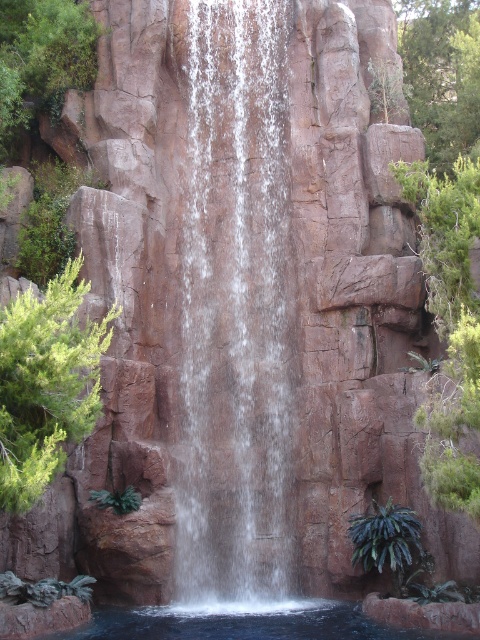
Question: Does smooth brown rock at center appear on the left side of green leafy tree at upper right?

Choices:
 (A) no
 (B) yes

Answer: (B)

Question: Based on their relative distances, which object is farther from the clear water at bottom?

Choices:
 (A) green leafy plant at lower right
 (B) green leafy plant at upper left
 (C) green leafy tree at left
 (D) smooth brown rock at center

Answer: (B)

Question: Is green leafy tree at left positioned behind clear water at bottom?

Choices:
 (A) yes
 (B) no

Answer: (B)

Question: Observing the image, what is the correct spatial positioning of smooth brown rock at center in reference to green leafy plant at lower right?

Choices:
 (A) above
 (B) below

Answer: (A)

Question: Which object is positioned farthest from the clear water at bottom?

Choices:
 (A) green leafy tree at left
 (B) green leafy tree at upper right

Answer: (B)

Question: Which point is farther to the camera?

Choices:
 (A) (373, 508)
 (B) (37, 42)
 (C) (435, 131)

Answer: (C)